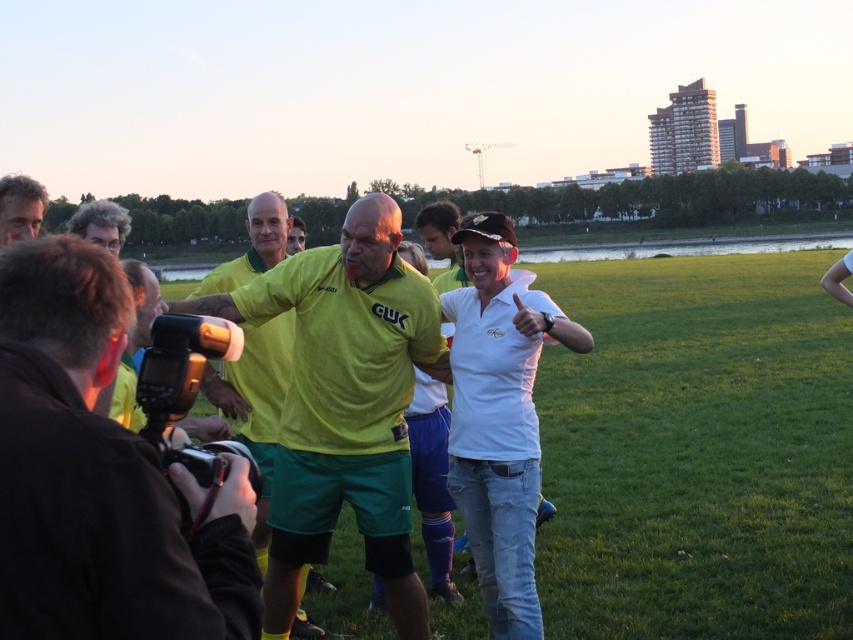
You are a spectator at the event and want to take a photo of the two people at the center. Which object, the matte green shorts at center or the yellow matte shirt at center, would appear larger in the photo?

The yellow matte shirt at center would appear larger in the photo because it is bigger than the matte green shorts at center.